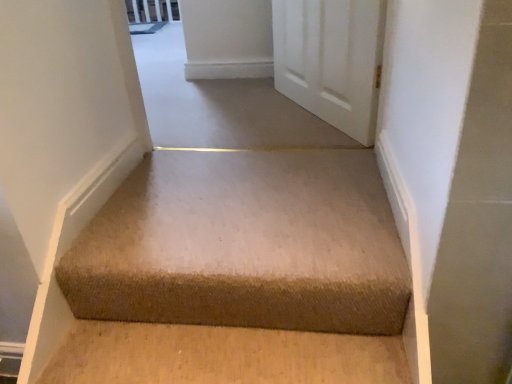
Question: Does beige carpet at upper center have a lesser height compared to beige carpet at center?

Choices:
 (A) no
 (B) yes

Answer: (A)

Question: Is beige carpet at upper center at the left side of beige carpet at center?

Choices:
 (A) no
 (B) yes

Answer: (B)

Question: From a real-world perspective, does beige carpet at upper center sit lower than beige carpet at center?

Choices:
 (A) yes
 (B) no

Answer: (B)

Question: Can beige carpet at center be found inside beige carpet at upper center?

Choices:
 (A) yes
 (B) no

Answer: (B)

Question: From the image's perspective, is beige carpet at upper center located above beige carpet at center?

Choices:
 (A) yes
 (B) no

Answer: (A)

Question: Can you confirm if beige carpet at upper center is taller than beige carpet at center?

Choices:
 (A) yes
 (B) no

Answer: (A)

Question: Could you tell me if beige carpet at center is turned towards beige carpet at upper center?

Choices:
 (A) no
 (B) yes

Answer: (A)

Question: From the image's perspective, would you say beige carpet at center is positioned over beige carpet at upper center?

Choices:
 (A) no
 (B) yes

Answer: (A)

Question: Would you say beige carpet at center is outside beige carpet at upper center?

Choices:
 (A) no
 (B) yes

Answer: (B)

Question: Is beige carpet at center far away from beige carpet at upper center?

Choices:
 (A) no
 (B) yes

Answer: (A)

Question: Could beige carpet at upper center be considered to be inside beige carpet at center?

Choices:
 (A) yes
 (B) no

Answer: (B)

Question: Can you confirm if beige carpet at center is thinner than beige carpet at upper center?

Choices:
 (A) yes
 (B) no

Answer: (A)

Question: From a real-world perspective, relative to beige carpet at center, is beige carpet at upper center vertically above or below?

Choices:
 (A) above
 (B) below

Answer: (A)